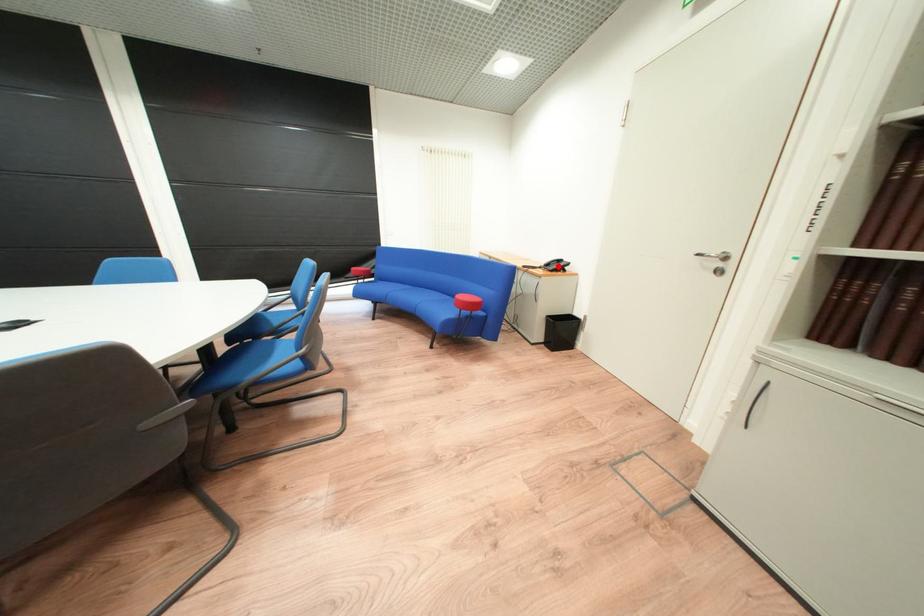
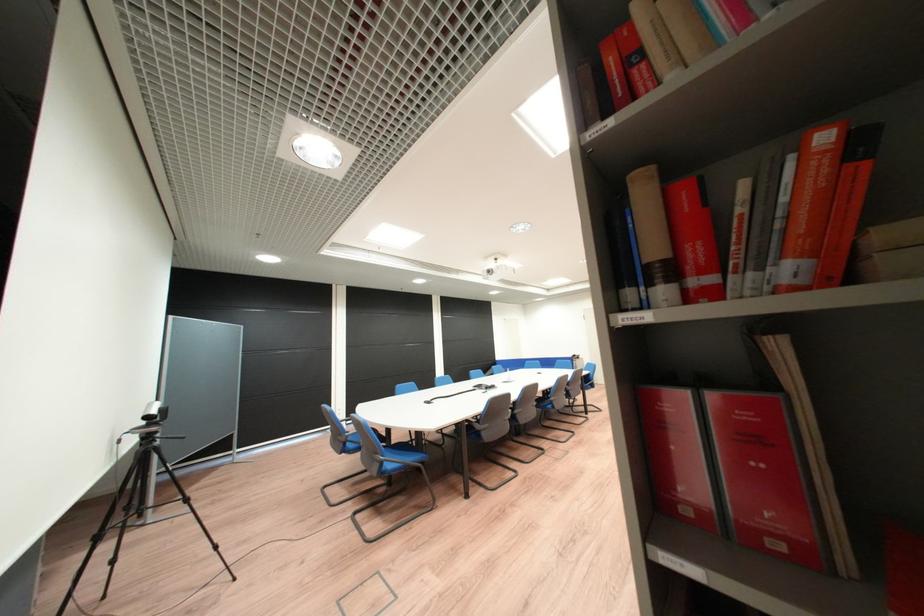
Question: I am providing you with two images of the same scene from different viewpoints. A red point is marked on the first image. At the location where the point appears in image 1, is it still visible in image 2?

Choices:
 (A) Yes
 (B) No

Answer: (B)